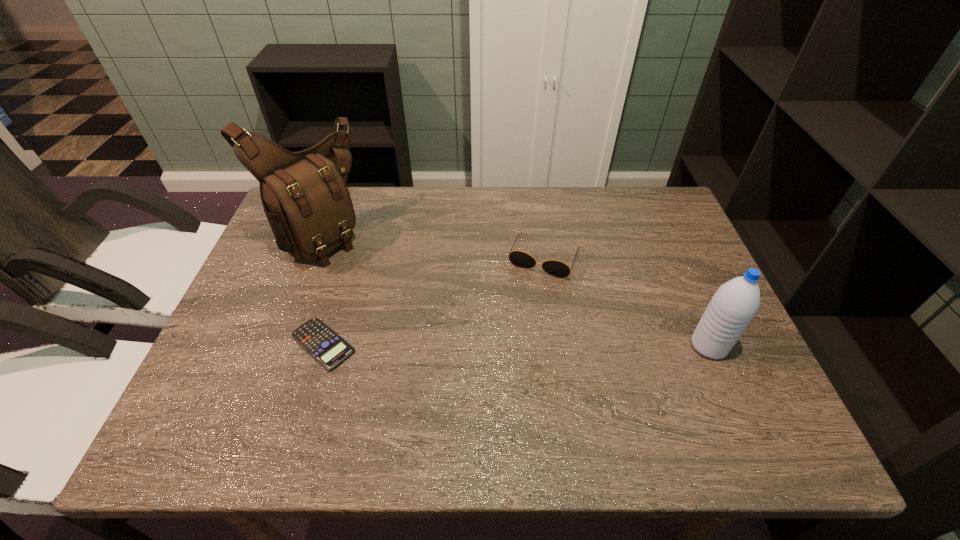
I want to click on free space located 0.300m on the front-facing side of the tallest object, so click(427, 310).

Locate an element on the screen. free location located on the front-facing side of the third object from left to right is located at coordinates (502, 354).

Locate an element on the screen. This screenshot has width=960, height=540. vacant point located 0.250m on the front-facing side of the third object from left to right is located at coordinates (502, 354).

You are a GUI agent. You are given a task and a screenshot of the screen. Output one action in this format:
    pyautogui.click(x=<x>, y=<y>)
    Task: Click on the free space located on the front-facing side of the third object from left to right
    The height and width of the screenshot is (540, 960).
    Given the screenshot: What is the action you would take?
    pyautogui.click(x=510, y=337)

Locate an element on the screen. shoulder bag that is at the far edge is located at coordinates click(x=304, y=196).

Where is `sunglasses that is at the far edge`? The height and width of the screenshot is (540, 960). sunglasses that is at the far edge is located at coordinates (521, 259).

Where is `object present at the near edge`? Image resolution: width=960 pixels, height=540 pixels. object present at the near edge is located at coordinates (329, 349).

The height and width of the screenshot is (540, 960). What are the coordinates of `calculator that is at the left edge` in the screenshot? It's located at (329, 349).

Where is `shoulder bag at the left edge`? shoulder bag at the left edge is located at coordinates (304, 196).

Where is `object at the right edge`? This screenshot has height=540, width=960. object at the right edge is located at coordinates (733, 306).